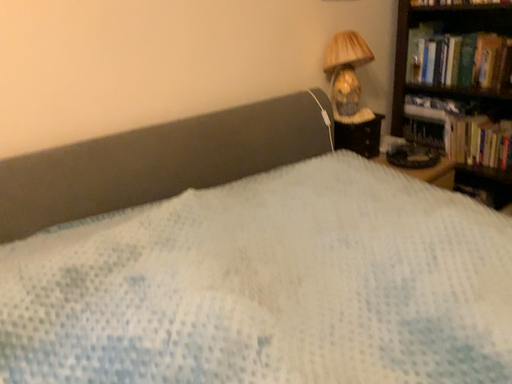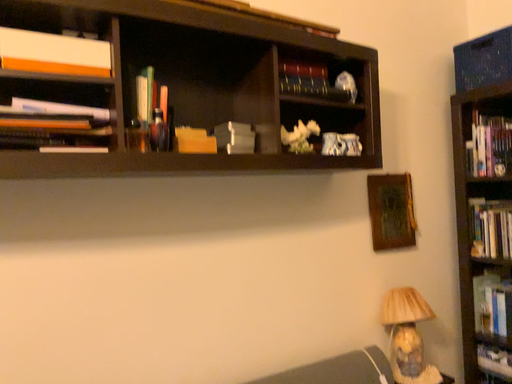
Question: Which way did the camera rotate in the video?

Choices:
 (A) rotated downward
 (B) rotated upward

Answer: (B)